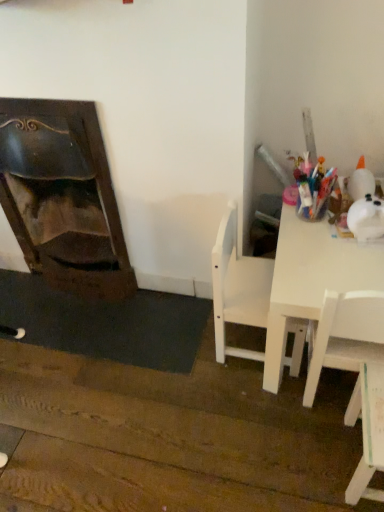
Question: From the image's perspective, would you say white glossy table at right is shown under white matte chair at center, placed as the first chair when sorted from left to right?

Choices:
 (A) no
 (B) yes

Answer: (A)

Question: From a real-world perspective, is white glossy table at right located higher than white matte chair at center, placed as the first chair when sorted from left to right?

Choices:
 (A) yes
 (B) no

Answer: (B)

Question: Considering the relative positions of white glossy table at right and white matte chair at center, placed as the first chair when sorted from left to right, in the image provided, is white glossy table at right to the left of white matte chair at center, placed as the first chair when sorted from left to right, from the viewer's perspective?

Choices:
 (A) yes
 (B) no

Answer: (B)

Question: From a real-world perspective, does white glossy table at right sit lower than white matte chair at center, placed as the first chair when sorted from left to right?

Choices:
 (A) yes
 (B) no

Answer: (A)

Question: Is white glossy table at right outside white matte chair at center, placed as the first chair when sorted from left to right?

Choices:
 (A) yes
 (B) no

Answer: (A)

Question: Considering the positions of white glossy table at right and white matte chair at center, placed as the first chair when sorted from left to right, in the image, is white glossy table at right bigger or smaller than white matte chair at center, placed as the first chair when sorted from left to right,?

Choices:
 (A) small
 (B) big

Answer: (B)

Question: From a real-world perspective, relative to white matte chair at center, marked as the 2th chair in a right-to-left arrangement, is white glossy table at right vertically above or below?

Choices:
 (A) above
 (B) below

Answer: (B)

Question: From the image's perspective, relative to white matte chair at center, placed as the first chair when sorted from left to right, is white glossy table at right above or below?

Choices:
 (A) above
 (B) below

Answer: (A)

Question: Is white glossy table at right inside or outside of white matte chair at center, placed as the first chair when sorted from left to right?

Choices:
 (A) outside
 (B) inside

Answer: (A)

Question: Considering the positions of white matte chair at lower right, marked as the first chair in a right-to-left arrangement, and dark wood fireplace at left in the image, is white matte chair at lower right, marked as the first chair in a right-to-left arrangement, taller or shorter than dark wood fireplace at left?

Choices:
 (A) tall
 (B) short

Answer: (B)

Question: Is white matte chair at lower right, marked as the first chair in a right-to-left arrangement, to the left or to the right of dark wood fireplace at left in the image?

Choices:
 (A) left
 (B) right

Answer: (B)

Question: From a real-world perspective, is white matte chair at lower right, marked as the first chair in a right-to-left arrangement, above or below dark wood fireplace at left?

Choices:
 (A) below
 (B) above

Answer: (A)

Question: Looking at the image, does white matte chair at lower right, marked as the first chair in a right-to-left arrangement, seem bigger or smaller compared to dark wood fireplace at left?

Choices:
 (A) big
 (B) small

Answer: (B)

Question: Relative to white matte chair at center, placed as the first chair when sorted from left to right, is dark wood fireplace at left in front or behind?

Choices:
 (A) front
 (B) behind

Answer: (B)

Question: Considering the positions of dark wood fireplace at left and white matte chair at center, marked as the 2th chair in a right-to-left arrangement, in the image, is dark wood fireplace at left taller or shorter than white matte chair at center, marked as the 2th chair in a right-to-left arrangement,?

Choices:
 (A) short
 (B) tall

Answer: (B)